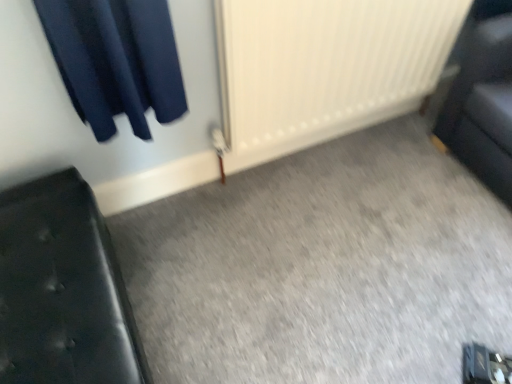
Question: Would you say white textured radiator at center is a long distance from black leather couch at left?

Choices:
 (A) no
 (B) yes

Answer: (A)

Question: Can you confirm if white textured radiator at center is positioned to the left of black leather couch at left?

Choices:
 (A) no
 (B) yes

Answer: (A)

Question: Does white textured radiator at center have a lesser width compared to black leather couch at left?

Choices:
 (A) no
 (B) yes

Answer: (B)

Question: Is white textured radiator at center facing away from black leather couch at left?

Choices:
 (A) yes
 (B) no

Answer: (B)

Question: From the image's perspective, is white textured radiator at center on black leather couch at left?

Choices:
 (A) yes
 (B) no

Answer: (A)

Question: Is white textured radiator at center shorter than black leather couch at left?

Choices:
 (A) no
 (B) yes

Answer: (A)

Question: Can you confirm if black leather couch at left is taller than white textured radiator at center?

Choices:
 (A) no
 (B) yes

Answer: (A)

Question: Is black leather couch at left at the right side of white textured radiator at center?

Choices:
 (A) no
 (B) yes

Answer: (A)

Question: From a real-world perspective, is black leather couch at left on top of white textured radiator at center?

Choices:
 (A) no
 (B) yes

Answer: (A)

Question: From the image's perspective, is black leather couch at left below white textured radiator at center?

Choices:
 (A) no
 (B) yes

Answer: (B)

Question: Does black leather couch at left have a lesser height compared to white textured radiator at center?

Choices:
 (A) no
 (B) yes

Answer: (B)

Question: Is black leather couch at left bigger than white textured radiator at center?

Choices:
 (A) no
 (B) yes

Answer: (A)

Question: Does point (440, 3) appear closer or farther from the camera than point (70, 223)?

Choices:
 (A) farther
 (B) closer

Answer: (A)